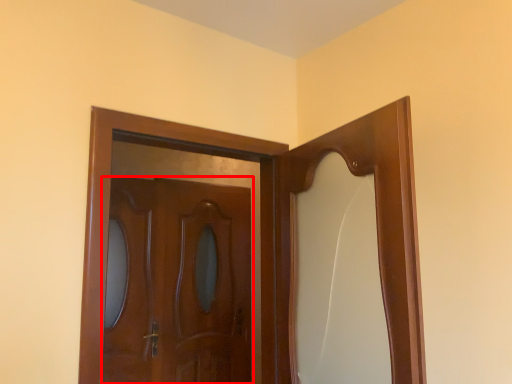
Question: In this image, where is door (annotated by the red box) located relative to door?

Choices:
 (A) right
 (B) left

Answer: (B)